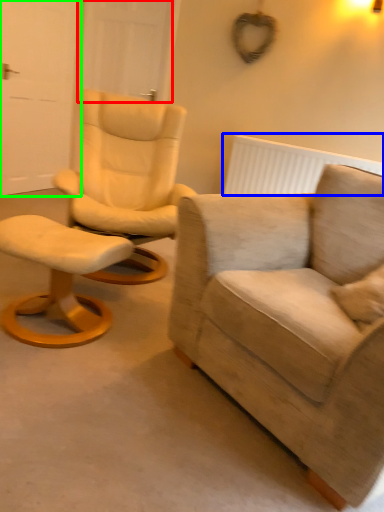
Question: Estimate the real-world distances between objects in this image. Which object is closer to door (highlighted by a red box), radiator (highlighted by a blue box) or door (highlighted by a green box)?

Choices:
 (A) radiator
 (B) door

Answer: (B)